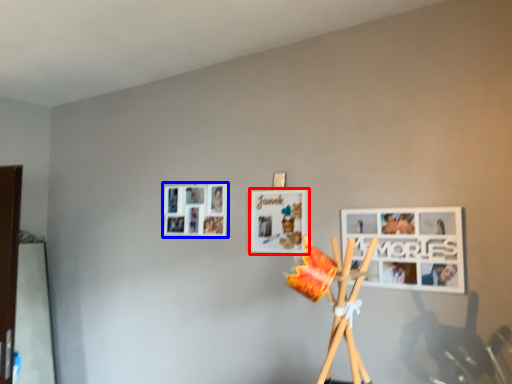
Question: Which object appears closest to the camera in this image, picture frame (highlighted by a red box) or picture frame (highlighted by a blue box)?

Choices:
 (A) picture frame
 (B) picture frame

Answer: (A)